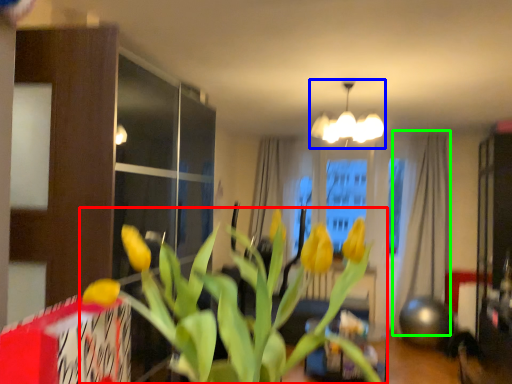
Question: Which object is positioned farthest from houseplant (highlighted by a red box)? Select from lamp (highlighted by a blue box) and curtain (highlighted by a green box).

Choices:
 (A) lamp
 (B) curtain

Answer: (B)